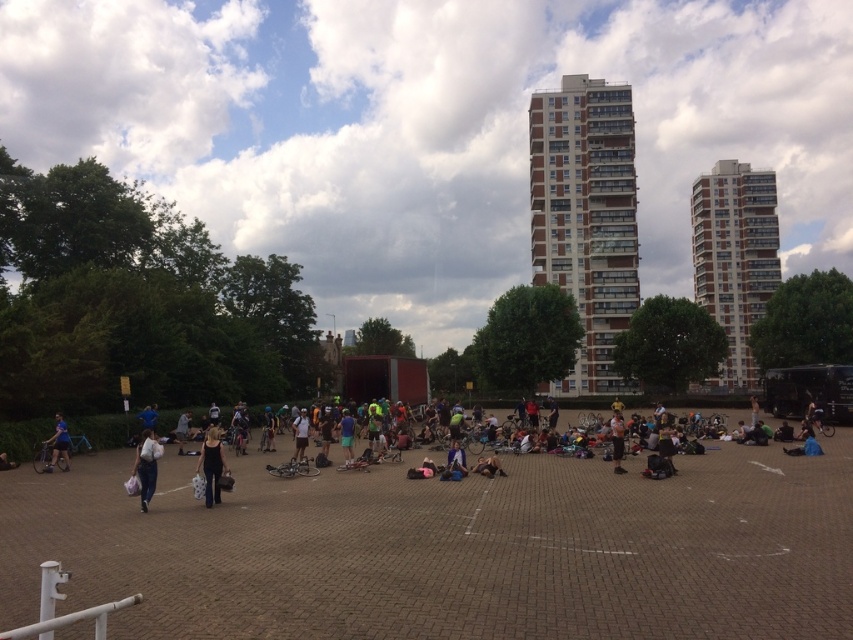
Consider the image. Does black matte tank top at center have a lesser width compared to matte blue shorts at lower left?

Incorrect, black matte tank top at center's width is not less than matte blue shorts at lower left's.

Can you confirm if black matte tank top at center is smaller than matte blue shorts at lower left?

Actually, black matte tank top at center might be larger than matte blue shorts at lower left.

Which is behind, point (218, 456) or point (67, 452)?

Positioned behind is point (67, 452).

You are a GUI agent. You are given a task and a screenshot of the screen. Output one action in this format:
    pyautogui.click(x=<x>, y=<y>)
    Task: Click on the black matte tank top at center
    This screenshot has width=853, height=640.
    Given the screenshot: What is the action you would take?
    pyautogui.click(x=212, y=465)

Which is in front, point (622, 202) or point (764, 289)?

Point (622, 202)

Describe the element at coordinates (585, 216) in the screenshot. I see `brown brick building at center` at that location.

The width and height of the screenshot is (853, 640). What do you see at coordinates (585, 216) in the screenshot?
I see `brown brick building at center` at bounding box center [585, 216].

You are a GUI agent. You are given a task and a screenshot of the screen. Output one action in this format:
    pyautogui.click(x=<x>, y=<y>)
    Task: Click on the brown brick building at center
    
    Given the screenshot: What is the action you would take?
    pyautogui.click(x=585, y=216)

Can you confirm if brown brick building at center is positioned above white cotton shirt at center?

Indeed, brown brick building at center is positioned over white cotton shirt at center.

Which is below, brown brick building at center or white cotton shirt at center?

Positioned lower is white cotton shirt at center.

Is point (635, 275) closer to viewer compared to point (616, 467)?

No, it is not.

Find the location of `brown brick building at center`. brown brick building at center is located at coordinates (585, 216).